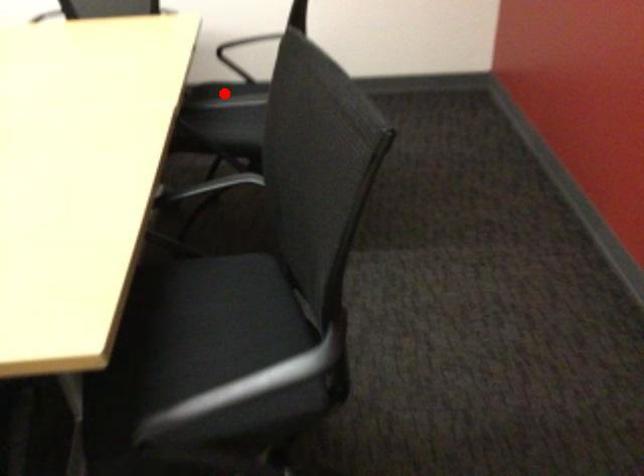
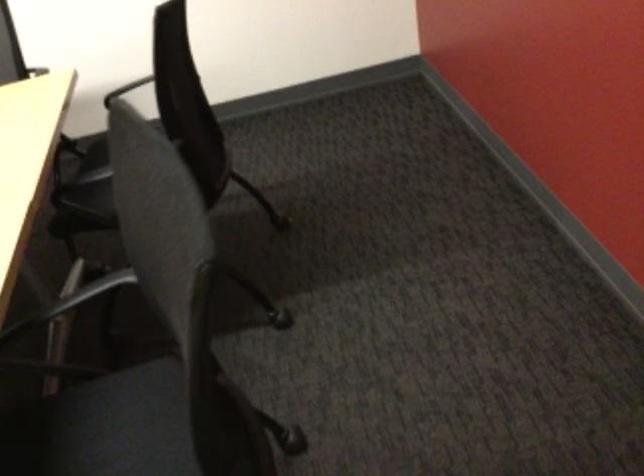
Question: I am providing you with two images of the same scene from different viewpoints. A red point is marked on the first image. Can you still see the location of the red point in image 2?

Choices:
 (A) Yes
 (B) No

Answer: (B)